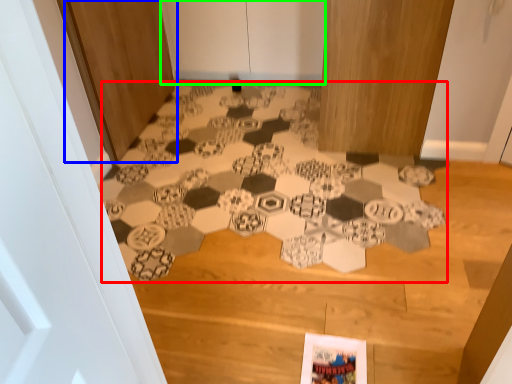
Question: Which is nearer to the print (highlighted by a red box)? door (highlighted by a blue box) or door (highlighted by a green box).

Choices:
 (A) door
 (B) door

Answer: (A)